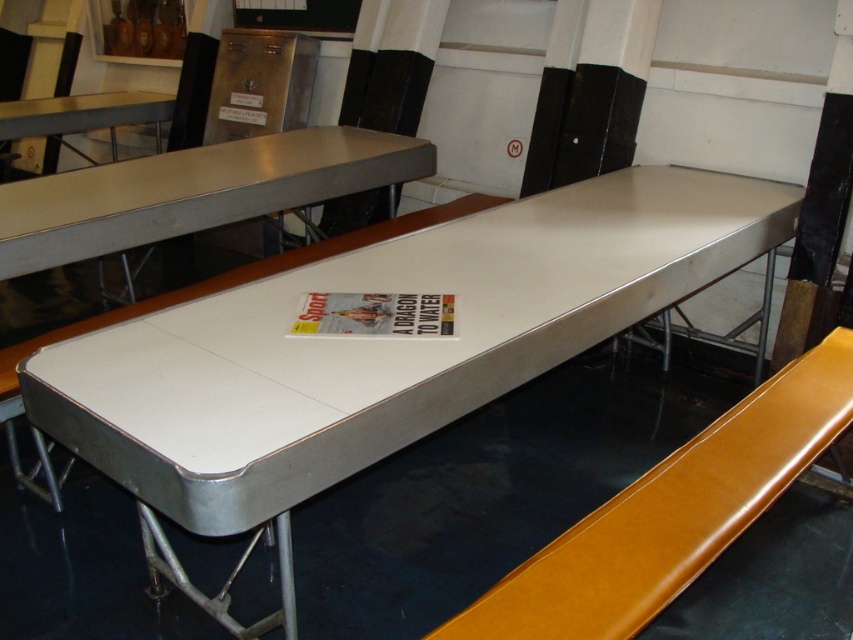
Does matte yellow bench at center appear on the right side of metallic silver table at center?

Yes, matte yellow bench at center is to the right of metallic silver table at center.

Can you confirm if matte yellow bench at center is positioned below metallic silver table at center?

Yes, matte yellow bench at center is below metallic silver table at center.

Identify the location of matte yellow bench at center. (671, 513).

Describe the element at coordinates (383, 344) in the screenshot. I see `white glossy table at center` at that location.

Where is `white glossy table at center`? white glossy table at center is located at coordinates (383, 344).

In order to click on white glossy table at center in this screenshot , I will do `click(383, 344)`.

Identify the location of white glossy table at center. Image resolution: width=853 pixels, height=640 pixels. (383, 344).

Is white glossy table at center taller than matte yellow bench at center?

Yes.

The width and height of the screenshot is (853, 640). What do you see at coordinates (383, 344) in the screenshot? I see `white glossy table at center` at bounding box center [383, 344].

In order to click on white glossy table at center in this screenshot , I will do `click(383, 344)`.